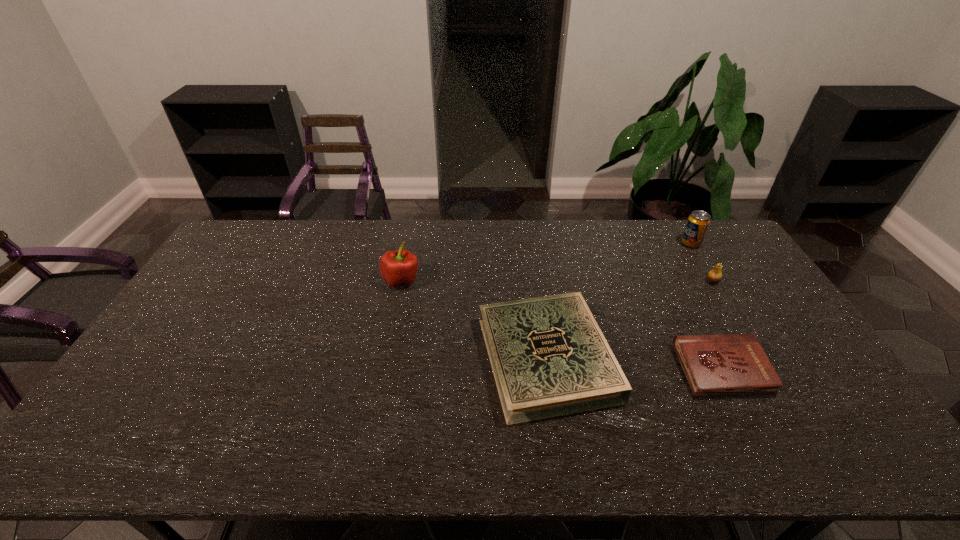
Image resolution: width=960 pixels, height=540 pixels. What are the coordinates of `vacant region located 0.140m on the right of the left hardback book` in the screenshot? It's located at (664, 358).

This screenshot has height=540, width=960. I want to click on free location located 0.370m on the left of the shortest object, so click(x=544, y=370).

The width and height of the screenshot is (960, 540). What are the coordinates of `object that is at the far edge` in the screenshot? It's located at (698, 222).

Find the location of `soda can present at the right edge`. soda can present at the right edge is located at coordinates (698, 222).

At what (x,y) coordinates should I click in order to perform the action: click on pear that is at the right edge. Please return your answer as a coordinate pair (x, y). Looking at the image, I should click on (715, 275).

Identify the location of object that is positioned at the far right corner. (698, 222).

Locate an element on the screen. free space at the far edge of the desktop is located at coordinates (603, 242).

Locate an element on the screen. This screenshot has width=960, height=540. free space at the near edge of the desktop is located at coordinates (578, 437).

Where is `free space at the left edge`? free space at the left edge is located at coordinates (192, 299).

At what (x,y) coordinates should I click in order to perform the action: click on vacant space at the right edge of the desktop. Please return your answer as a coordinate pair (x, y). This screenshot has width=960, height=540. Looking at the image, I should click on (789, 406).